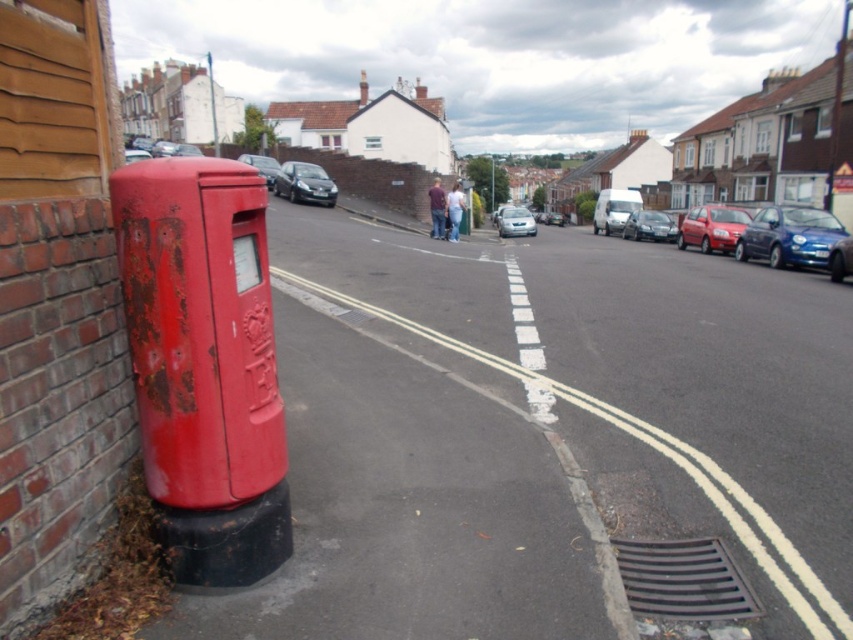
Based on the photo, which is above, rusty metal mailbox at left or metallic silver car at center?

Positioned higher is metallic silver car at center.

Between rusty metal mailbox at left and metallic silver car at center, which one appears on the left side from the viewer's perspective?

Positioned to the left is rusty metal mailbox at left.

Find the location of a particular element. This screenshot has height=640, width=853. rusty metal mailbox at left is located at coordinates (204, 364).

In order to click on rusty metal mailbox at left in this screenshot , I will do `click(204, 364)`.

Between point (827, 225) and point (682, 230), which one is positioned in front?

Positioned in front is point (827, 225).

Does metallic blue car at right have a lesser width compared to metallic red car at right?

Indeed, metallic blue car at right has a lesser width compared to metallic red car at right.

The height and width of the screenshot is (640, 853). Find the location of `metallic blue car at right`. metallic blue car at right is located at coordinates (788, 236).

Between metallic red car at right and shiny metallic car at center, which one has less height?

Standing shorter between the two is shiny metallic car at center.

Which is behind, point (699, 211) or point (293, 202)?

The point (293, 202) is behind.

The image size is (853, 640). Identify the location of metallic red car at right. (712, 227).